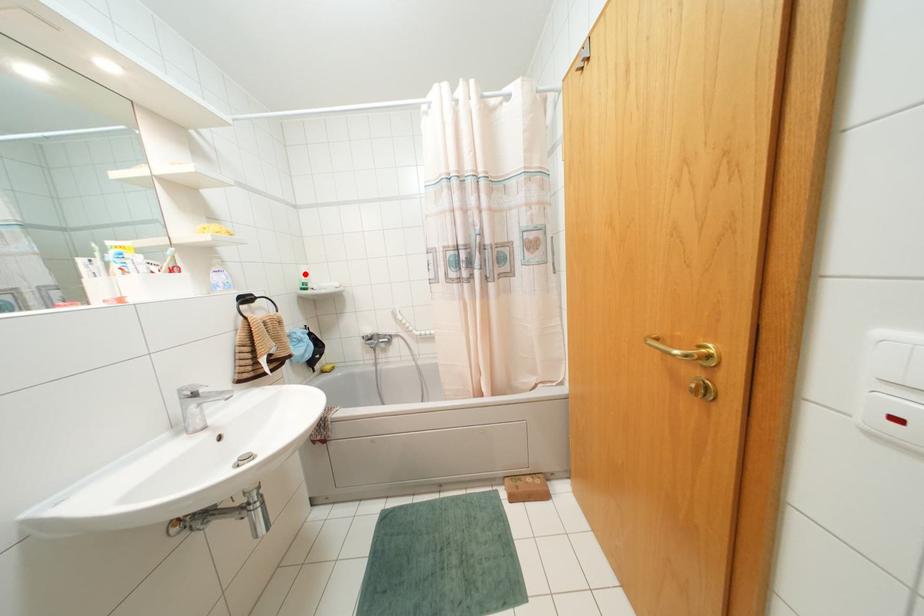
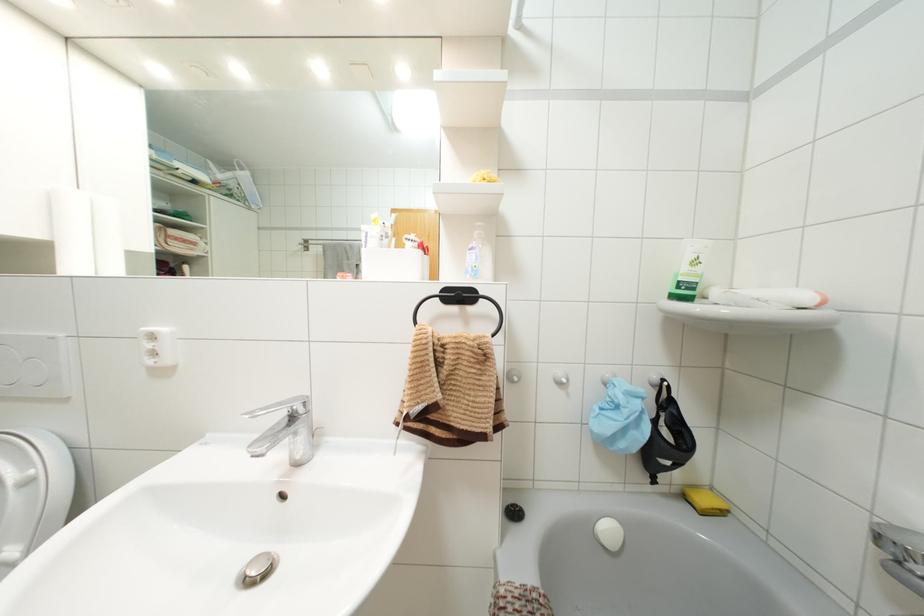
In the second image, find the point that corresponds to the highlighted location in the first image.

(695, 262)